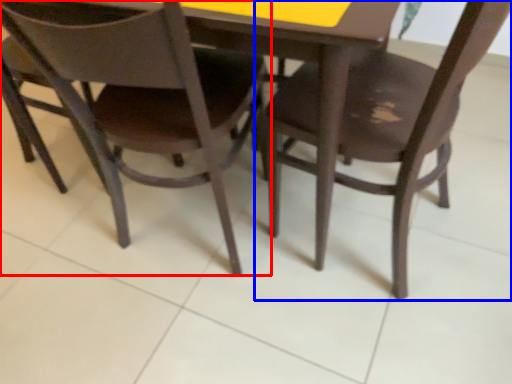
Question: Which object appears farthest to the camera in this image, chair (highlighted by a red box) or chair (highlighted by a blue box)?

Choices:
 (A) chair
 (B) chair

Answer: (A)